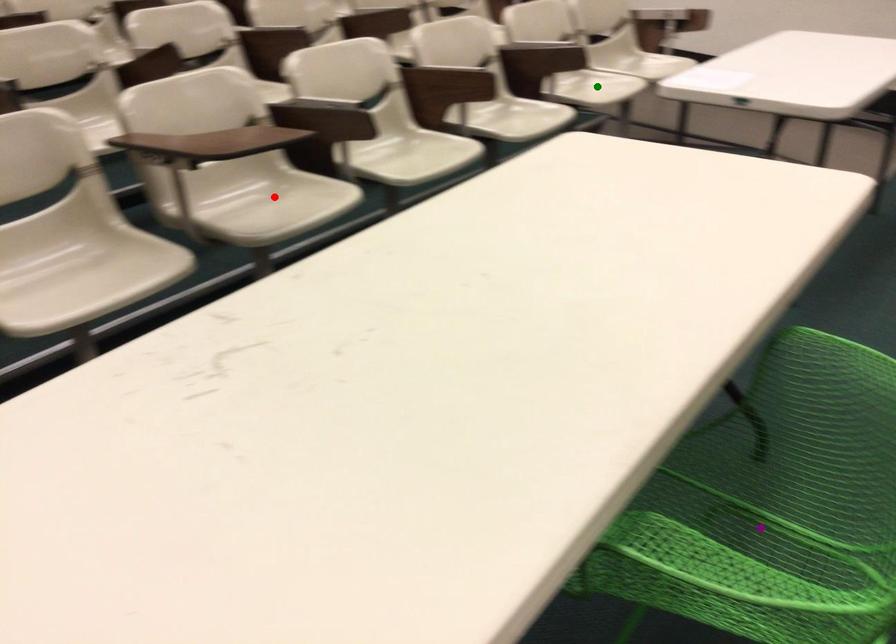
Order these from nearest to farthest:
red point
green point
purple point

purple point → red point → green point